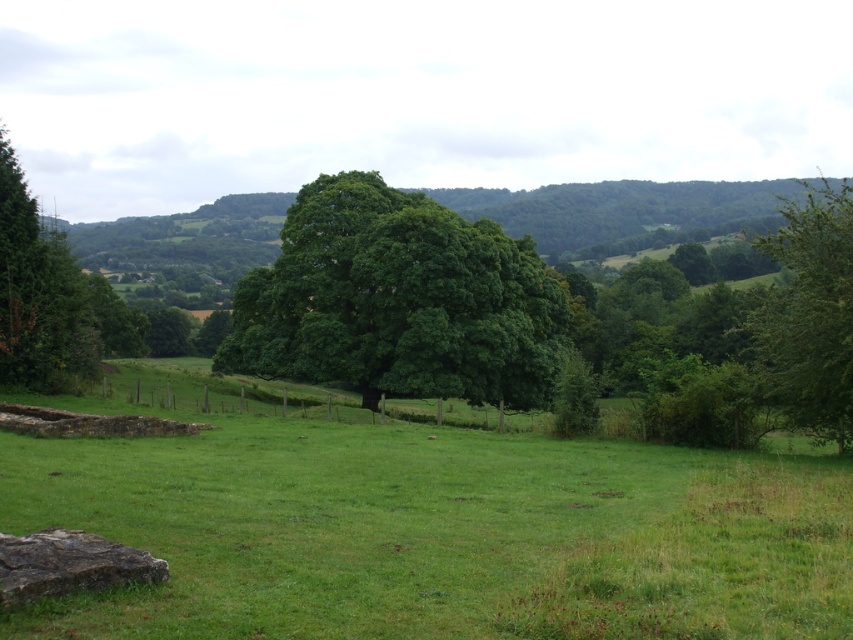
You are standing in the middle of the field and see the green leafy tree at center and the green leafy tree at left. Which tree is closer to your right side?

The green leafy tree at center is to the right of the green leafy tree at left, so the green leafy tree at center is closer to your right side.

You are standing at the edge of the green grass at center and want to look up at the green leafy tree at center. Which direction should you face to see the tree above you?

The green grass at center is below the green leafy tree at center, so you should face upward to see the tree above you.